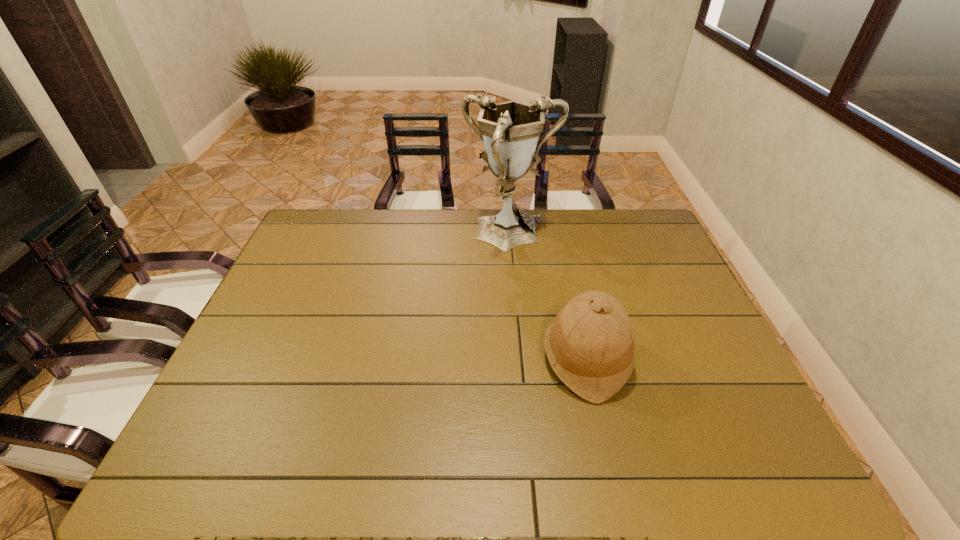
I want to click on vacant space at the near edge of the desktop, so click(429, 459).

Identify the location of vacant area at the left edge. Image resolution: width=960 pixels, height=540 pixels. (267, 308).

Locate an element on the screen. The image size is (960, 540). free region at the right edge of the desktop is located at coordinates click(x=659, y=299).

Where is `free space at the near left corner of the desktop`? This screenshot has width=960, height=540. free space at the near left corner of the desktop is located at coordinates (223, 451).

You are a GUI agent. You are given a task and a screenshot of the screen. Output one action in this format:
    pyautogui.click(x=<x>, y=<y>)
    Task: Click on the vacant space at the near right corner of the desktop
    
    Given the screenshot: What is the action you would take?
    pyautogui.click(x=781, y=456)